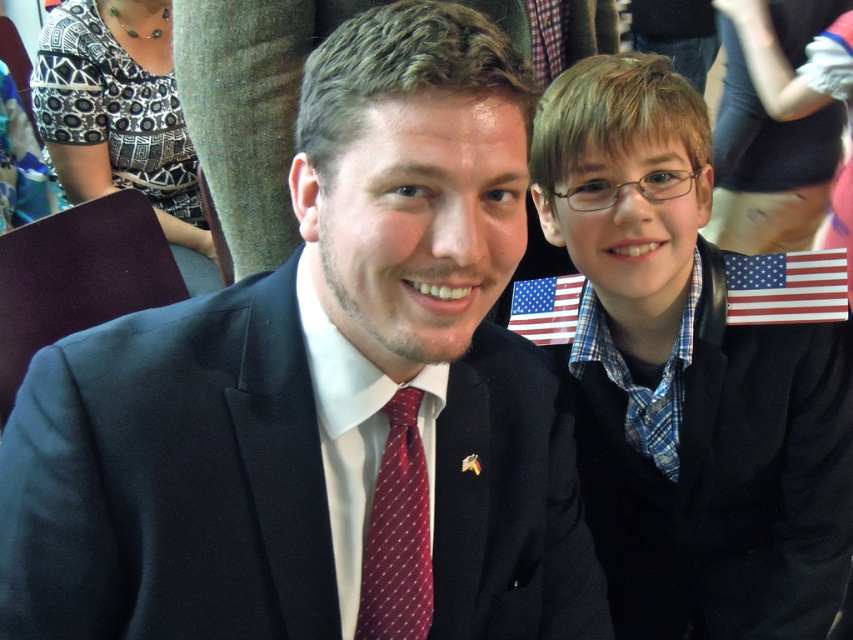
Question: Can you confirm if blue plaid shirt at center is wider than american flag at upper right?

Choices:
 (A) yes
 (B) no

Answer: (A)

Question: Is blue plaid shirt at center to the right of american flag at center from the viewer's perspective?

Choices:
 (A) no
 (B) yes

Answer: (B)

Question: Among these objects, which one is farthest from the camera?

Choices:
 (A) american flag at center
 (B) american flag at upper right
 (C) matte black suit at center

Answer: (A)

Question: Which point appears farthest from the camera in this image?

Choices:
 (A) (415, 580)
 (B) (828, 424)

Answer: (B)

Question: In this image, where is matte black suit at center located relative to maroon silk tie at center?

Choices:
 (A) left
 (B) right

Answer: (A)

Question: Which of the following is the closest to the observer?

Choices:
 (A) american flag at upper right
 (B) matte black suit at center

Answer: (B)